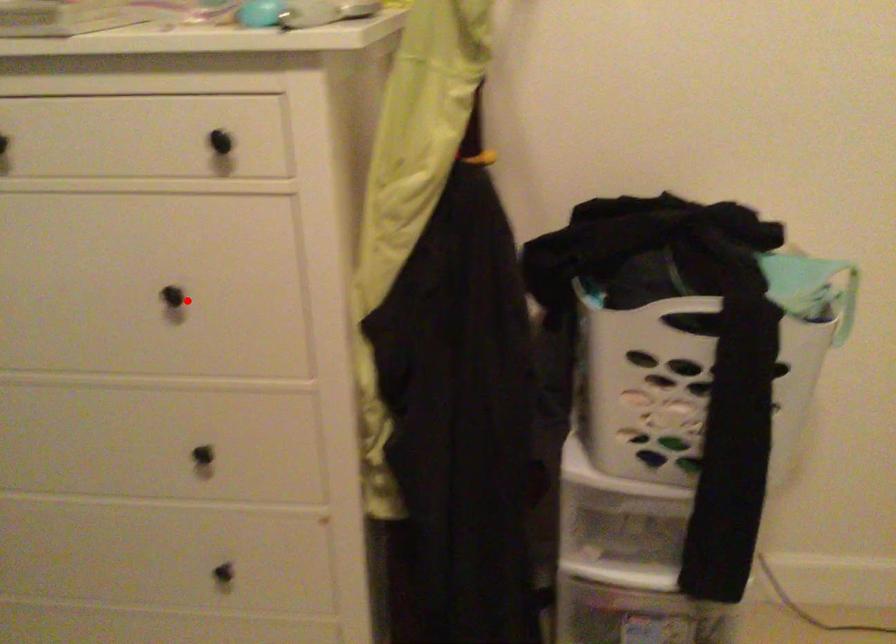
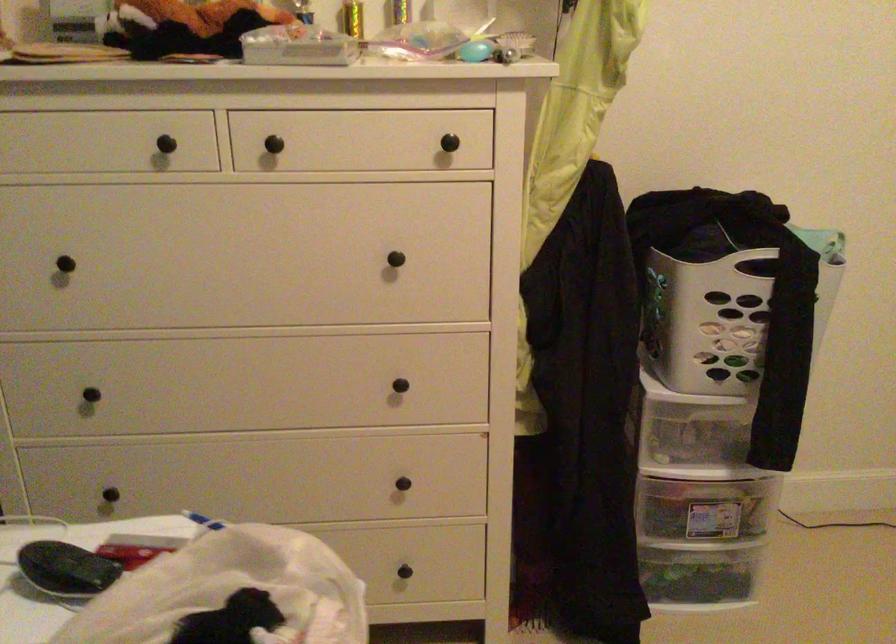
Where in the second image is the point corresponding to the highlighted location from the first image?

(400, 261)